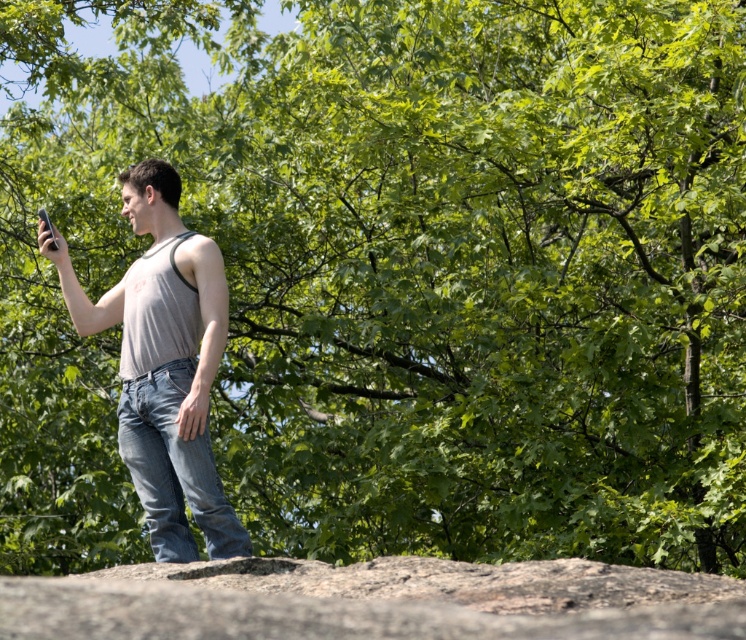
Question: Which point appears farthest from the camera in this image?

Choices:
 (A) tap(207, 568)
 (B) tap(159, 536)
 (C) tap(40, 212)

Answer: (C)

Question: Can you confirm if smooth gray rock at center is positioned to the left of gray cotton tank top at center?

Choices:
 (A) no
 (B) yes

Answer: (A)

Question: Among these objects, which one is nearest to the camera?

Choices:
 (A) gray cotton tank top at center
 (B) matte black phone at upper left

Answer: (A)

Question: Which of these objects is positioned closest to the smooth gray rock at center?

Choices:
 (A) gray cotton tank top at center
 (B) matte black phone at upper left

Answer: (A)

Question: Does gray cotton tank top at center come behind matte black phone at upper left?

Choices:
 (A) yes
 (B) no

Answer: (B)

Question: Can you confirm if smooth gray rock at center is positioned below matte black phone at upper left?

Choices:
 (A) no
 (B) yes

Answer: (B)